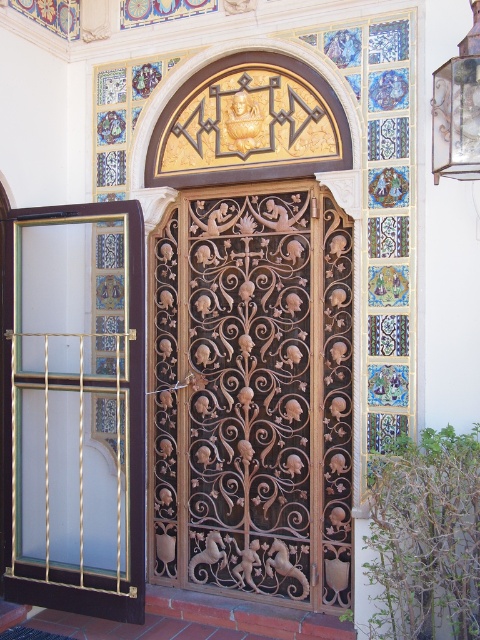
In the scene shown: Which of these two, brown wrought iron door at center or frosted glass screen door at left, stands taller?

Standing taller between the two is brown wrought iron door at center.

Does brown wrought iron door at center have a lesser height compared to frosted glass screen door at left?

In fact, brown wrought iron door at center may be taller than frosted glass screen door at left.

Who is more distant from viewer, (267,568) or (108,604)?

The point (267,568) is more distant.

This screenshot has height=640, width=480. Find the location of `brown wrought iron door at center`. brown wrought iron door at center is located at coordinates (252, 394).